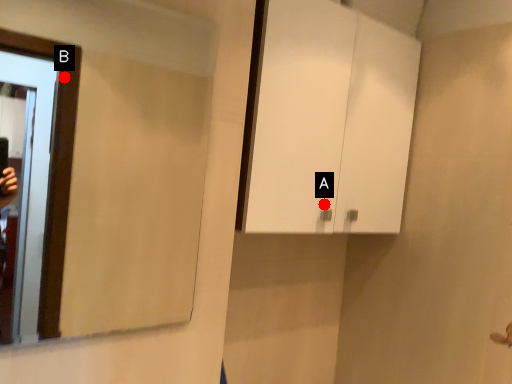
Question: Two points are circled on the image, labeled by A and B beside each circle. Which point is farther to the camera?

Choices:
 (A) A is further
 (B) B is further

Answer: (B)